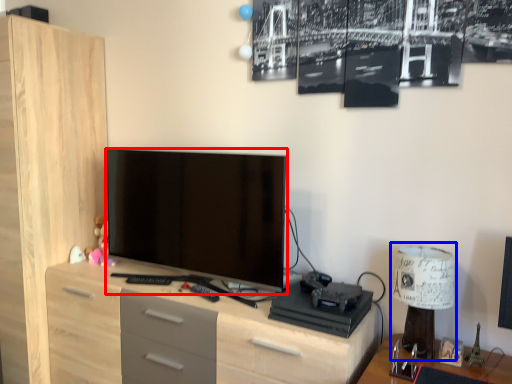
Question: Which point is closer to the camera, television (highlighted by a red box) or table lamp (highlighted by a blue box)?

Choices:
 (A) television
 (B) table lamp

Answer: (B)